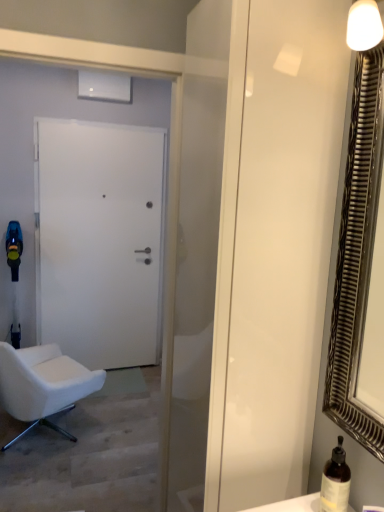
Question: Are metallic silver mirror at right and brown glass bottle at lower right far apart?

Choices:
 (A) yes
 (B) no

Answer: (B)

Question: From the image's perspective, is metallic silver mirror at right above brown glass bottle at lower right?

Choices:
 (A) no
 (B) yes

Answer: (B)

Question: Is metallic silver mirror at right taller than brown glass bottle at lower right?

Choices:
 (A) yes
 (B) no

Answer: (A)

Question: Is the depth of metallic silver mirror at right greater than that of brown glass bottle at lower right?

Choices:
 (A) no
 (B) yes

Answer: (A)

Question: Is metallic silver mirror at right shorter than brown glass bottle at lower right?

Choices:
 (A) no
 (B) yes

Answer: (A)

Question: From the image's perspective, is white matte door at center above or below transparent glass screen door at center?

Choices:
 (A) above
 (B) below

Answer: (A)

Question: Do you think white matte door at center is within transparent glass screen door at center, or outside of it?

Choices:
 (A) inside
 (B) outside

Answer: (B)

Question: Is point (92, 140) positioned closer to the camera than point (296, 419)?

Choices:
 (A) closer
 (B) farther

Answer: (B)

Question: In the image, is white matte door at center on the left side or the right side of transparent glass screen door at center?

Choices:
 (A) right
 (B) left

Answer: (B)

Question: From the image's perspective, is transparent glass screen door at center above or below white matte door at center?

Choices:
 (A) below
 (B) above

Answer: (A)

Question: In terms of width, does transparent glass screen door at center look wider or thinner when compared to white matte door at center?

Choices:
 (A) wide
 (B) thin

Answer: (A)

Question: Is point (264, 189) positioned closer to the camera than point (109, 133)?

Choices:
 (A) closer
 (B) farther

Answer: (A)

Question: Based on their sizes in the image, would you say transparent glass screen door at center is bigger or smaller than white matte door at center?

Choices:
 (A) big
 (B) small

Answer: (A)

Question: Is metallic silver mirror at right wider or thinner than white matte door at center?

Choices:
 (A) thin
 (B) wide

Answer: (A)

Question: Is metallic silver mirror at right bigger or smaller than white matte door at center?

Choices:
 (A) big
 (B) small

Answer: (B)